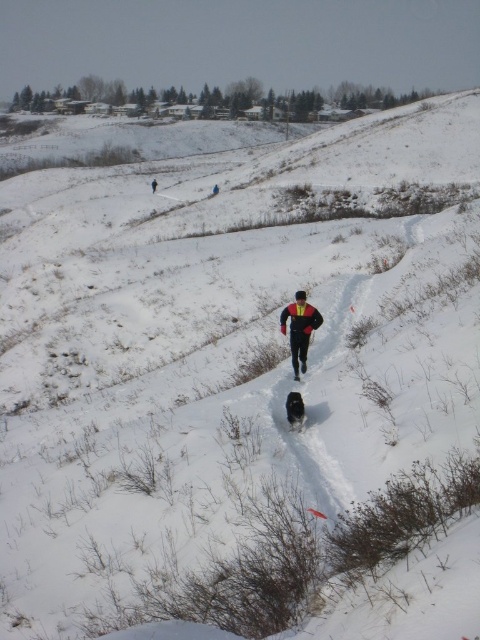
You are planning to place a 200 feet long fence between the matte black jacket at center and the black matte jacket at upper center. Will the fence be long enough to connect both jackets?

The distance between the matte black jacket at center and the black matte jacket at upper center is 219.34 feet. Since the fence is only 200 feet long, it will not be long enough to connect both jackets.

You are a photographer trying to capture both the matte black jacket at center and the black matte jacket at upper center in a single frame. Which jacket should you focus on first to ensure both are in the shot?

The matte black jacket at center has a lesser height compared to the black matte jacket at upper center, so you should focus on the black matte jacket at upper center first to ensure both are in the shot.

Consider the image. You are a hiker trying to identify the person in the snowy path. You see the matte black jacket at center and the black matte jacket at upper center. Which one is more likely to be the hiker you are following?

The matte black jacket at center is more likely to be the hiker you are following because it is thinner than the black matte jacket at upper center, suggesting it belongs to a person closer to the foreground.